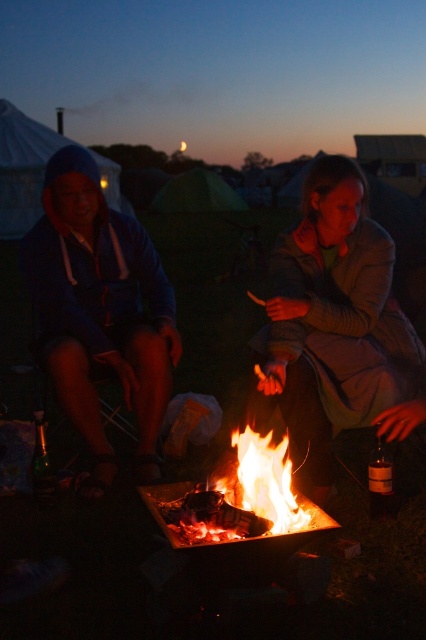
You are standing at the point marked as point [100,310]. Looking towards the campfire, which direction is the blue fleece jacket at left located relative to you?

The blue fleece jacket at left is located to your left side since the point marks its position.

You are packing for a camping trip and need to choose between the matte gray jacket at center and the blue fleece jacket at left. Based on their sizes, which jacket might be more suitable for colder weather?

The blue fleece jacket at left has a greater width than the matte gray jacket at center, making it potentially warmer and more suitable for colder weather.